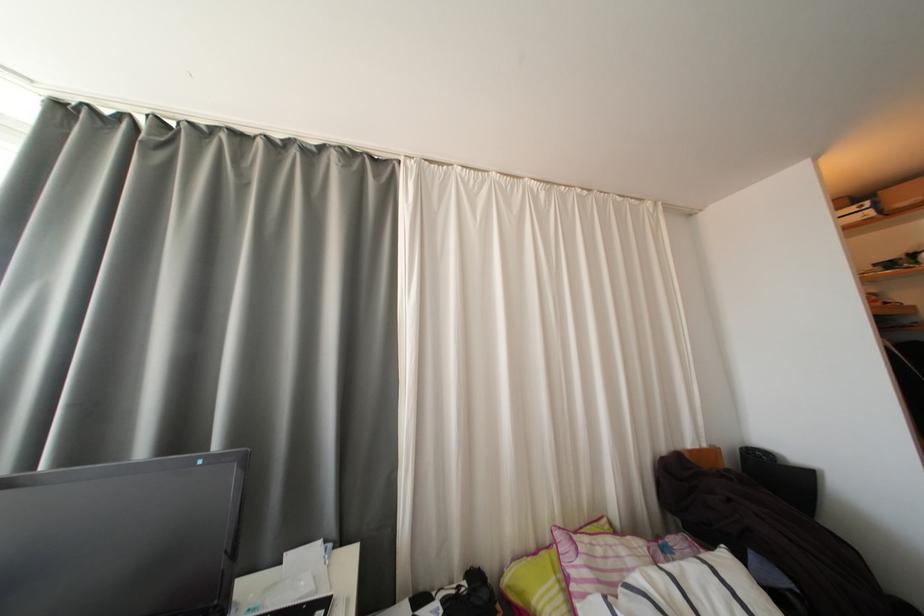
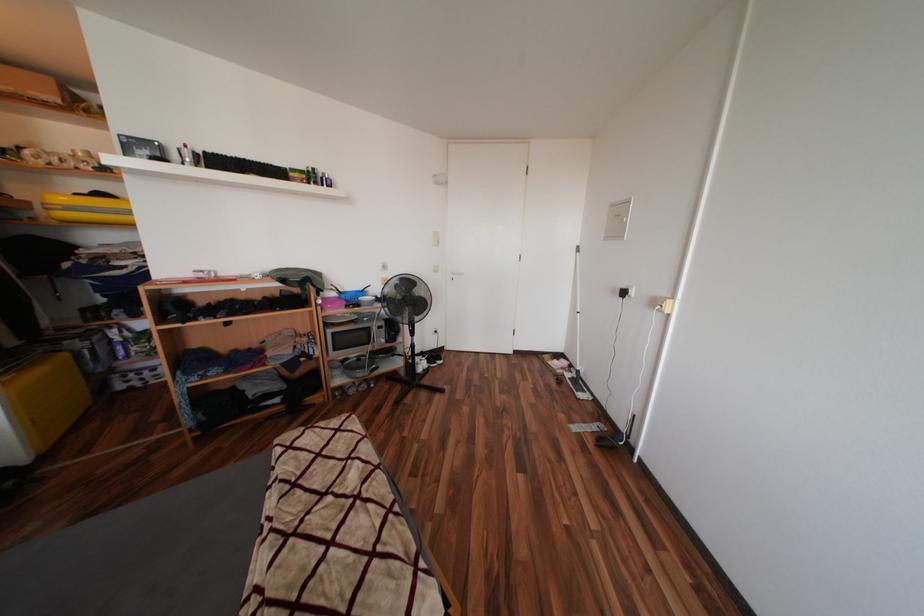
Question: The images are taken continuously from a first-person perspective. In which direction is your viewpoint rotating?

Choices:
 (A) Left
 (B) Right
 (C) Up
 (D) Down

Answer: (B)